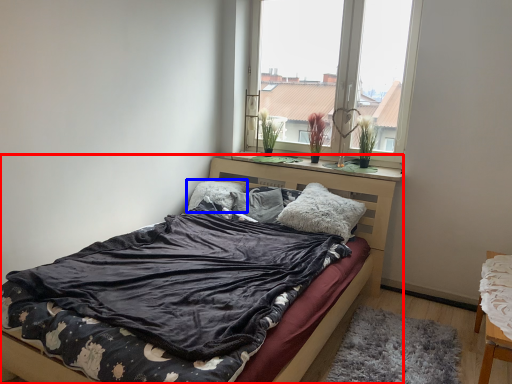
Question: Which point is closer to the camera, bed (highlighted by a red box) or pillow (highlighted by a blue box)?

Choices:
 (A) bed
 (B) pillow

Answer: (A)